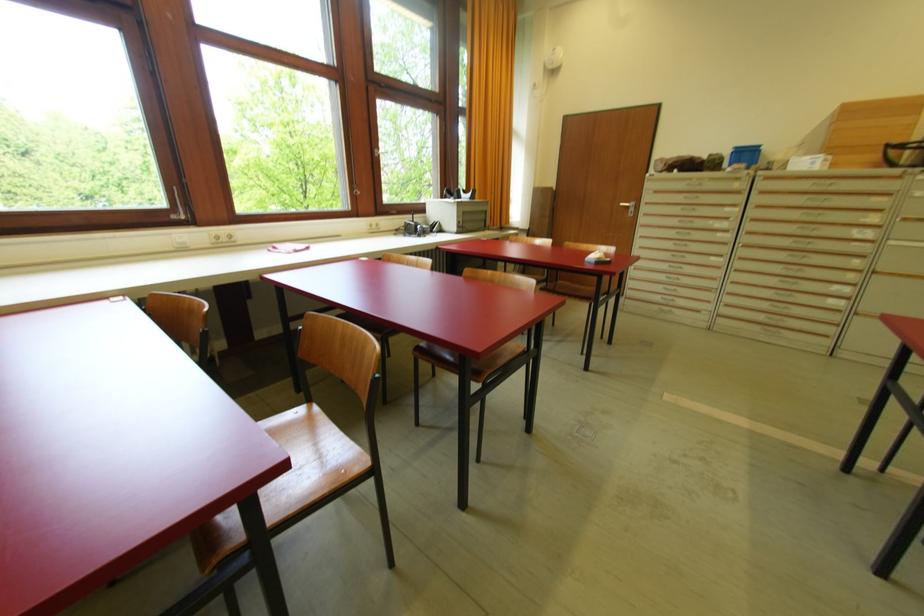
Find where to pull the silver door handle. Please return your answer as a coordinate pair (x, y).

(628, 207)